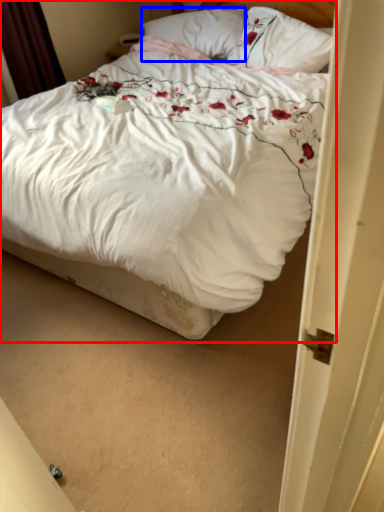
Question: Which point is closer to the camera, bed (highlighted by a red box) or pillow (highlighted by a blue box)?

Choices:
 (A) bed
 (B) pillow

Answer: (A)